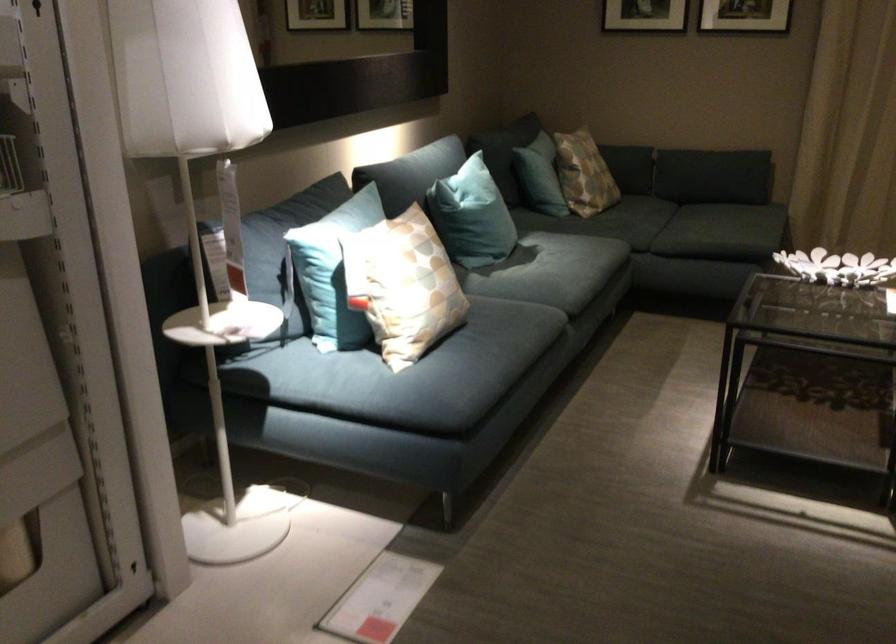
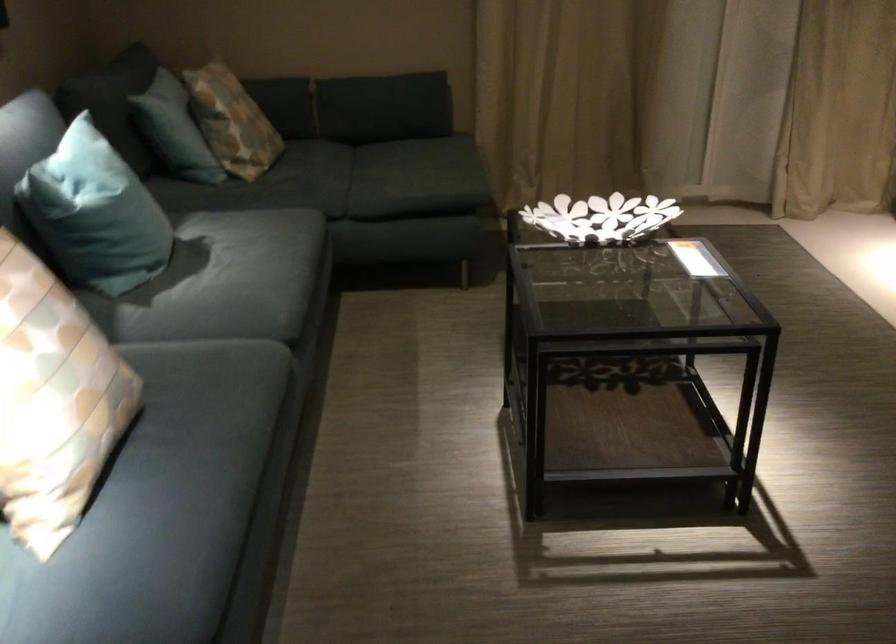
Question: The camera is either moving clockwise (left) or counter-clockwise (right) around the object. The first image is from the beginning of the video and the second image is from the end. Is the camera moving left or right when shooting the video?

Choices:
 (A) Left
 (B) Right

Answer: (A)